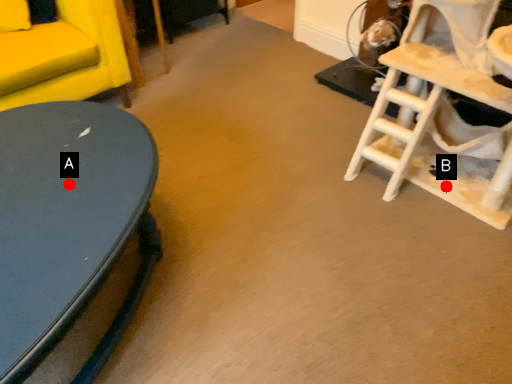
Question: Two points are circled on the image, labeled by A and B beside each circle. Among these points, which one is farthest from the camera?

Choices:
 (A) A is further
 (B) B is further

Answer: (B)